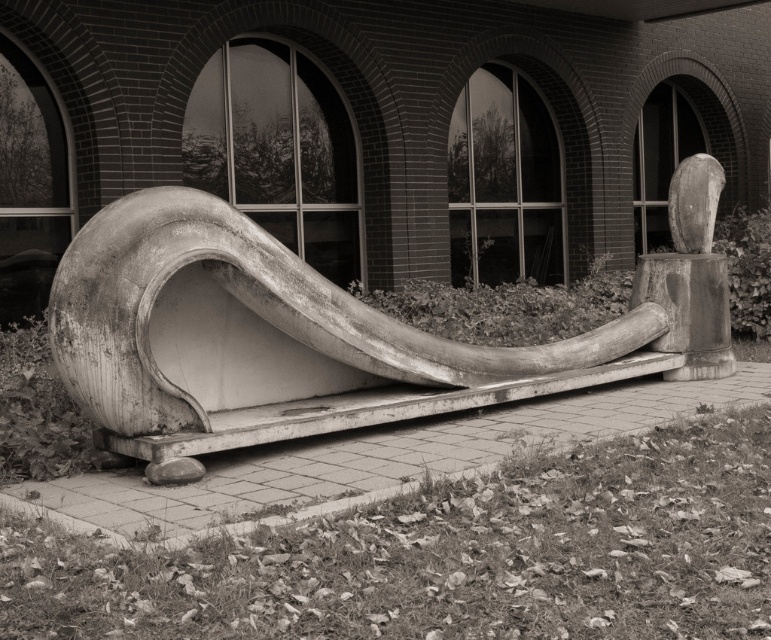
You are standing at the entrance of the building and want to reach the smooth concrete slide at center. According to the coordinates provided, in which direction should you walk from the building to find the slide?

The smooth concrete slide at center is located at coordinates point [251,323]. Since you are at the entrance of the building, you should walk towards the center area to reach it.

You are standing in front of the sculpture and want to touch both the smooth concrete slide at center and the smooth wood sculpture at center. Which object should you reach for first to touch the one closer to you?

The smooth concrete slide at center is closer to the viewer than the smooth wood sculpture at center, so you should reach for the smooth concrete slide at center first.